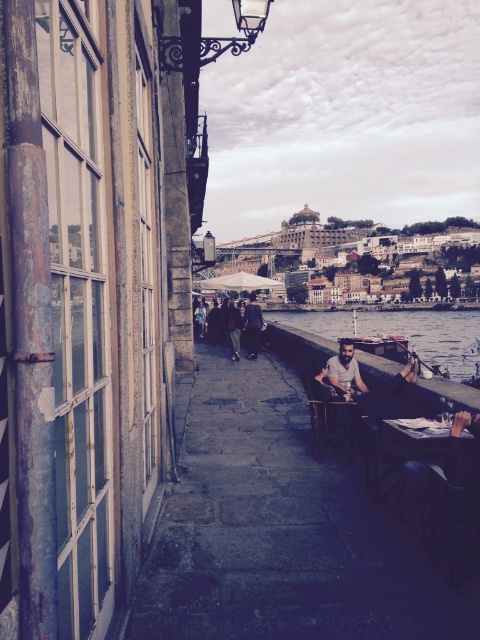
You are a photographer trying to capture a candid shot of the dark gray fabric jacket at center. You need to position yourself behind the light brown wooden chair at center to avoid being noticed. Is the chair wide enough to hide your full body from the jacket wearer?

The light brown wooden chair at center is narrower than the dark gray fabric jacket at center, so it might not be wide enough to fully hide your body from the jacket wearer.

You are a tourist visiting this riverside area and you want to sit down on the light brown wooden chair at center. However, you are wearing the dark gray fabric jacket at center. Can you sit on the chair without taking off your jacket?

The light brown wooden chair at center is not as tall as the dark gray fabric jacket at center, so the jacket is taller than the chair. Therefore, if the jacket is taller than the chair, you might need to remove it to sit comfortably, as the chair might not provide enough space for the jacket to fit properly when seated.

You are a visitor at this riverside and want to sit on the light brown wooden chair at center. However, there is a dark gray fabric jacket at center on it. Can you sit there without moving the jacket?

The light brown wooden chair at center is smaller than the dark gray fabric jacket at center, so the jacket is too big for the chair. You can sit there without moving the jacket, but the jacket might not fit properly on the chair.